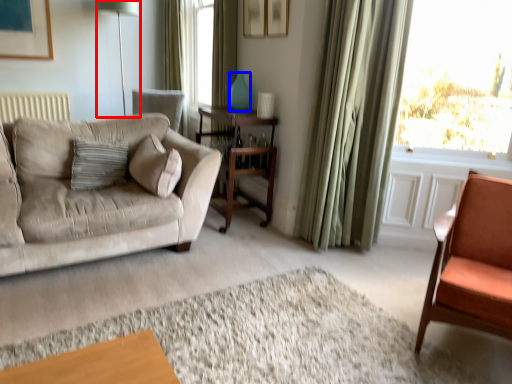
Question: Which object appears farthest to the camera in this image, table lamp (highlighted by a red box) or vase (highlighted by a blue box)?

Choices:
 (A) table lamp
 (B) vase

Answer: (A)